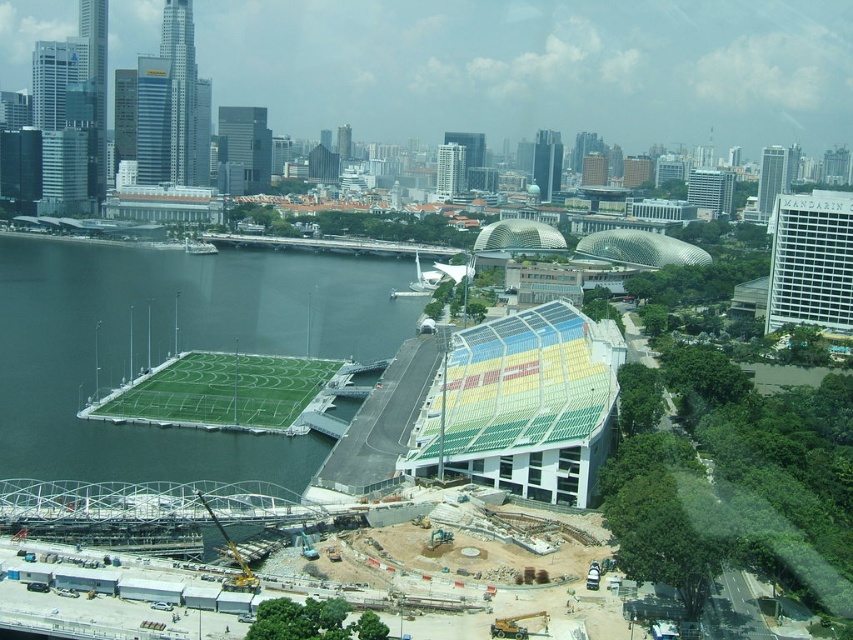
Is green artificial turf at left behind green artificial turf at lower left?

→ No, green artificial turf at left is in front of green artificial turf at lower left.

Which is more to the right, green artificial turf at left or green artificial turf at lower left?

green artificial turf at lower left is more to the right.

What do you see at coordinates (171, 348) in the screenshot?
I see `green artificial turf at left` at bounding box center [171, 348].

The height and width of the screenshot is (640, 853). What are the coordinates of `green artificial turf at left` in the screenshot? It's located at (171, 348).